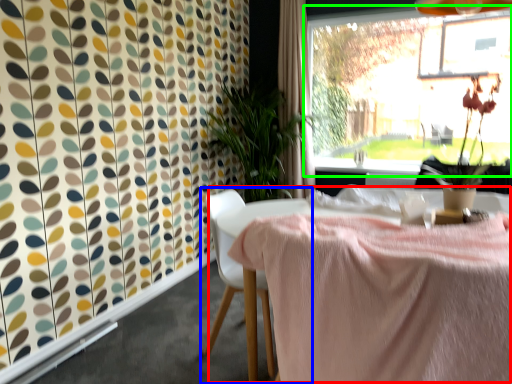
Question: Which is nearer to the table (highlighted by a red box)? chair (highlighted by a blue box) or window (highlighted by a green box).

Choices:
 (A) chair
 (B) window

Answer: (A)